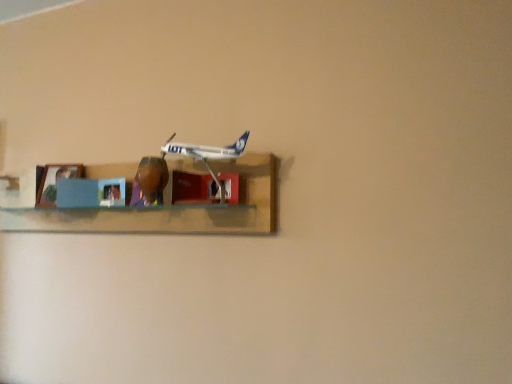
Question: From the image's perspective, is white plastic airplane at center above or below matte blue picture frame at left?

Choices:
 (A) above
 (B) below

Answer: (A)

Question: Does point (x=214, y=152) appear closer or farther from the camera than point (x=60, y=173)?

Choices:
 (A) closer
 (B) farther

Answer: (A)

Question: Which of these objects is positioned closest to the white plastic airplane at center?

Choices:
 (A) wooden shelf at center
 (B) matte blue picture frame at left

Answer: (A)

Question: Which object is the farthest from the matte blue picture frame at left?

Choices:
 (A) wooden shelf at center
 (B) white plastic airplane at center

Answer: (B)